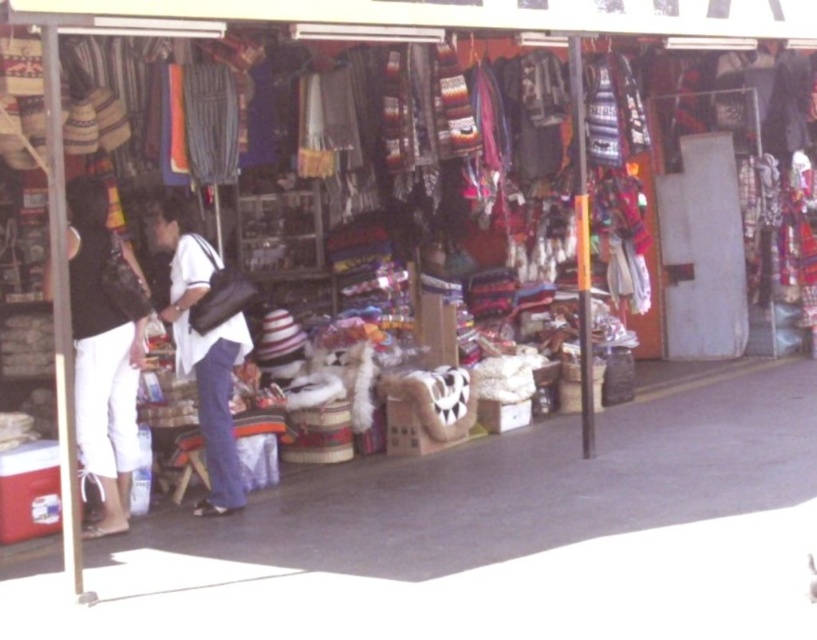
Question: From the image, what is the correct spatial relationship of white cotton pants at left in relation to white matte shirt at center?

Choices:
 (A) left
 (B) right

Answer: (A)

Question: Where is white cotton pants at left located in relation to white matte shirt at center in the image?

Choices:
 (A) left
 (B) right

Answer: (A)

Question: Which point is farther to the camera?

Choices:
 (A) 204,285
 (B) 109,513

Answer: (A)

Question: Which point appears farthest from the camera in this image?

Choices:
 (A) (145, 317)
 (B) (192, 298)

Answer: (B)

Question: Which point is closer to the camera?

Choices:
 (A) (233, 356)
 (B) (96, 397)

Answer: (B)

Question: Is white cotton pants at left to the left of white matte shirt at center from the viewer's perspective?

Choices:
 (A) yes
 (B) no

Answer: (A)